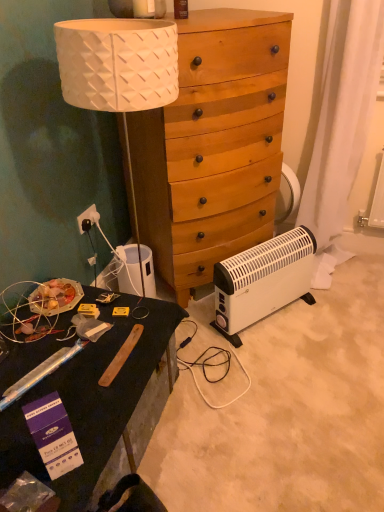
Question: Considering the relative positions of white plastic power outlet at lower left and white plastic radiator at lower right in the image provided, is white plastic power outlet at lower left to the left or to the right of white plastic radiator at lower right?

Choices:
 (A) left
 (B) right

Answer: (A)

Question: Based on their sizes in the image, would you say white plastic power outlet at lower left is bigger or smaller than white plastic radiator at lower right?

Choices:
 (A) small
 (B) big

Answer: (A)

Question: Which of these objects is positioned farthest from the white plastic radiator at lower right?

Choices:
 (A) white plastic power outlet at lower left
 (B) purple cardboard box at lower left
 (C) wooden dresser at center
 (D) black matte desk at lower left
 (E) translucent plastic bottle at upper center

Answer: (E)

Question: Which is nearer to the black matte desk at lower left?

Choices:
 (A) purple cardboard box at lower left
 (B) white plastic power outlet at lower left
 (C) translucent plastic bottle at upper center
 (D) white plastic radiator at lower right
 (E) wooden dresser at center

Answer: (A)